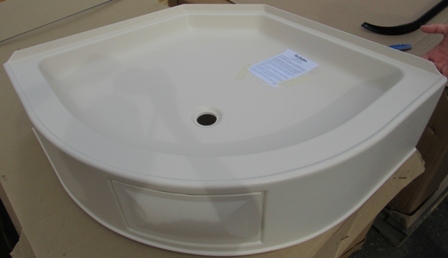
I want to click on curved edge of shower pan, so click(198, 157).